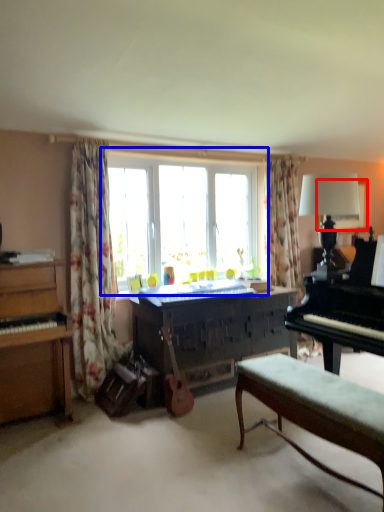
Question: Which point is further to the camera, picture frame (highlighted by a red box) or window (highlighted by a blue box)?

Choices:
 (A) picture frame
 (B) window

Answer: (A)